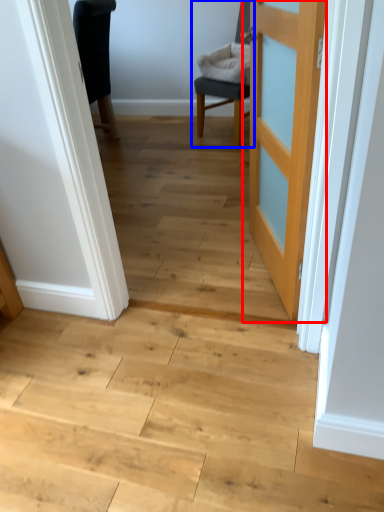
Question: Which object appears farthest to the camera in this image, door (highlighted by a red box) or chair (highlighted by a blue box)?

Choices:
 (A) door
 (B) chair

Answer: (B)